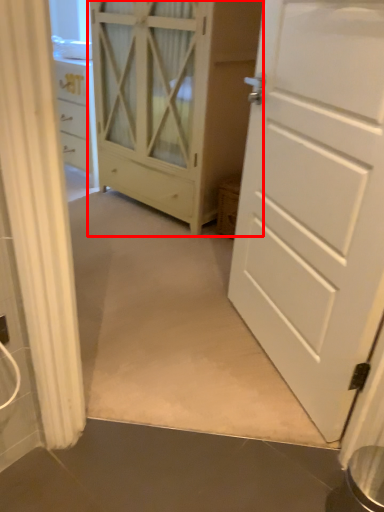
Question: In this image, where is cupboard (annotated by the red box) located relative to door?

Choices:
 (A) left
 (B) right

Answer: (A)